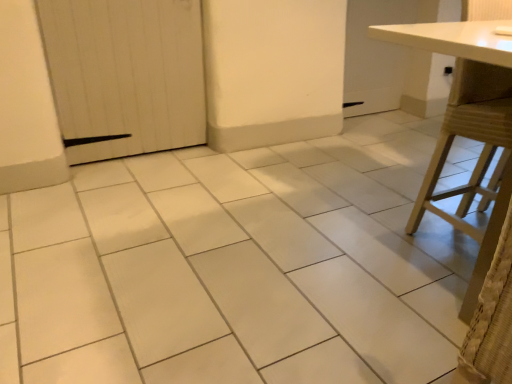
Question: Is white wood door at left positioned behind white matte table at right?

Choices:
 (A) no
 (B) yes

Answer: (B)

Question: Considering the relative positions of white wood door at left and white matte table at right in the image provided, is white wood door at left to the right of white matte table at right from the viewer's perspective?

Choices:
 (A) no
 (B) yes

Answer: (A)

Question: Is white matte table at right located within white wood door at left?

Choices:
 (A) yes
 (B) no

Answer: (B)

Question: Does white wood door at left have a smaller size compared to white matte table at right?

Choices:
 (A) yes
 (B) no

Answer: (A)

Question: Is white wood door at left looking in the opposite direction of white matte table at right?

Choices:
 (A) yes
 (B) no

Answer: (B)

Question: From a real-world perspective, is white wood door at left below white matte table at right?

Choices:
 (A) no
 (B) yes

Answer: (B)

Question: Is white matte table at right bigger than white wood door at left?

Choices:
 (A) no
 (B) yes

Answer: (B)

Question: Is white matte table at right taller than white wood door at left?

Choices:
 (A) no
 (B) yes

Answer: (B)

Question: Does white matte table at right have a lesser width compared to white wood door at left?

Choices:
 (A) no
 (B) yes

Answer: (A)

Question: Is white matte table at right looking in the opposite direction of white wood door at left?

Choices:
 (A) yes
 (B) no

Answer: (B)

Question: Is white matte table at right to the right of white wood door at left from the viewer's perspective?

Choices:
 (A) yes
 (B) no

Answer: (A)

Question: Is white matte table at right shorter than white wood door at left?

Choices:
 (A) no
 (B) yes

Answer: (A)

Question: From a real-world perspective, is white wood door at left above or below white matte table at right?

Choices:
 (A) below
 (B) above

Answer: (A)